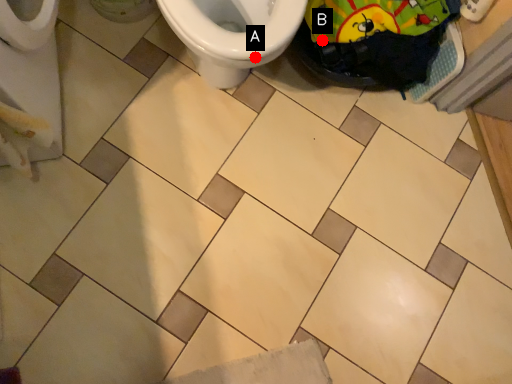
Question: Two points are circled on the image, labeled by A and B beside each circle. Which point is farther from the camera taking this photo?

Choices:
 (A) A is further
 (B) B is further

Answer: (B)